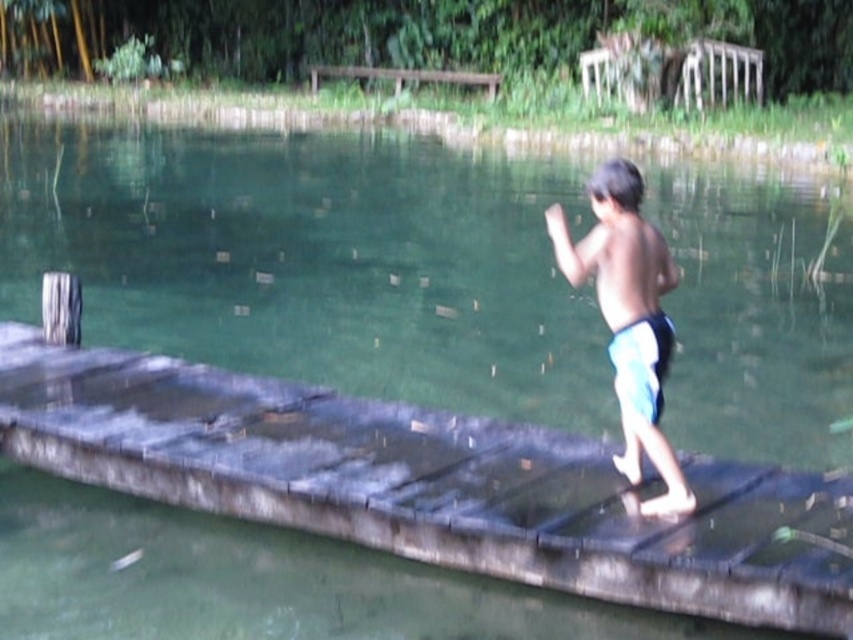
Question: Is blue/white shorts at center smaller than brown wooden dock at upper center?

Choices:
 (A) yes
 (B) no

Answer: (B)

Question: Which of the following is the closest to the observer?

Choices:
 (A) blue/white shorts at center
 (B) brown wooden dock at upper center

Answer: (A)

Question: Does blue/white shorts at center appear on the left side of brown wooden dock at upper center?

Choices:
 (A) yes
 (B) no

Answer: (B)

Question: Can you confirm if blue/white shorts at center is smaller than brown wooden dock at upper center?

Choices:
 (A) yes
 (B) no

Answer: (B)

Question: Which object appears farthest from the camera in this image?

Choices:
 (A) blue/white shorts at center
 (B) brown wooden dock at upper center

Answer: (B)